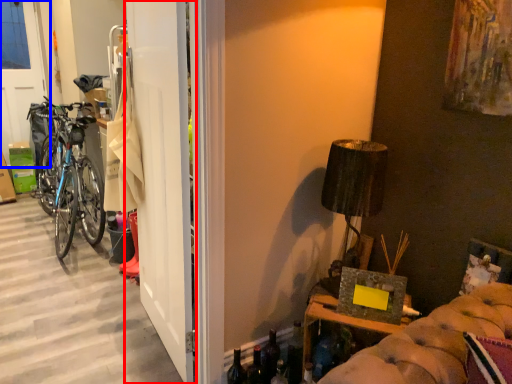
Question: Which of the following is the farthest to the observer, door (highlighted by a red box) or screen door (highlighted by a blue box)?

Choices:
 (A) door
 (B) screen door

Answer: (B)